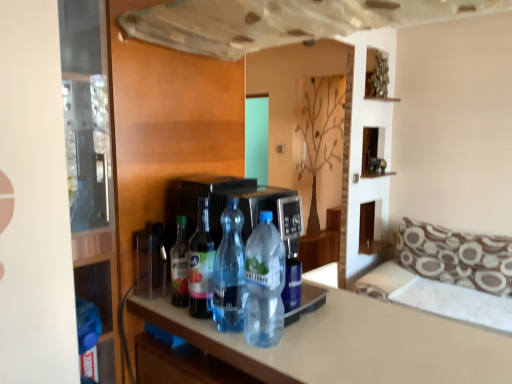
This screenshot has height=384, width=512. I want to click on free space to the left of translucent plastic bottle at center, which appears as the third bottle when viewed from the right, so click(167, 315).